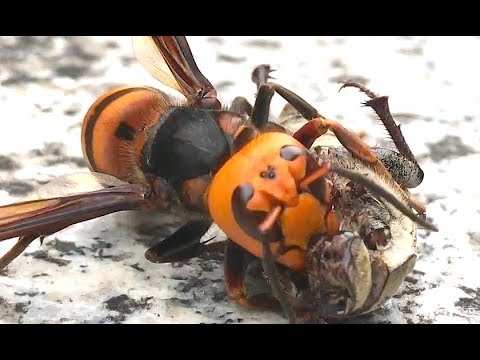
This screenshot has width=480, height=360. I want to click on granite surface, so click(133, 282).